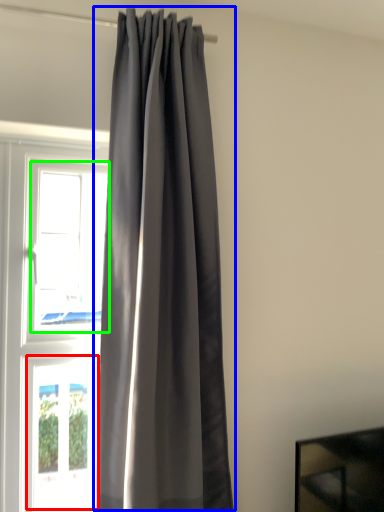
Question: Which object is the farthest from window (highlighted by a red box)? Choose among these: curtain (highlighted by a blue box) or window (highlighted by a green box).

Choices:
 (A) curtain
 (B) window

Answer: (B)